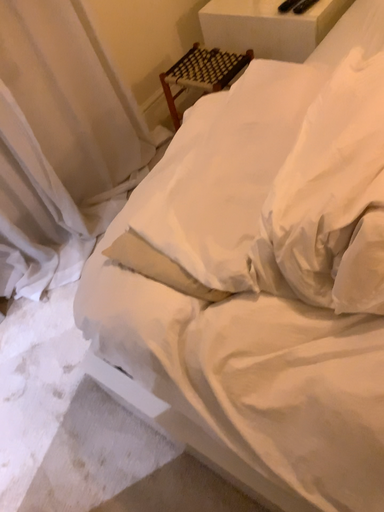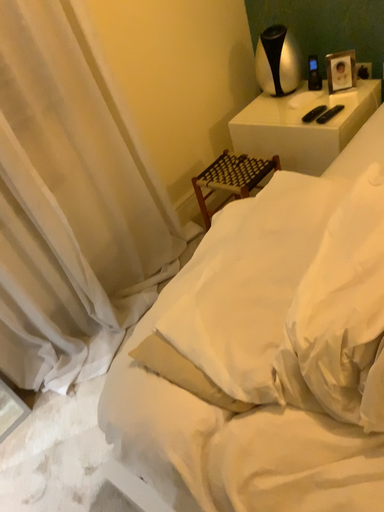
Question: How did the camera likely rotate when shooting the video?

Choices:
 (A) rotated downward
 (B) rotated upward

Answer: (B)